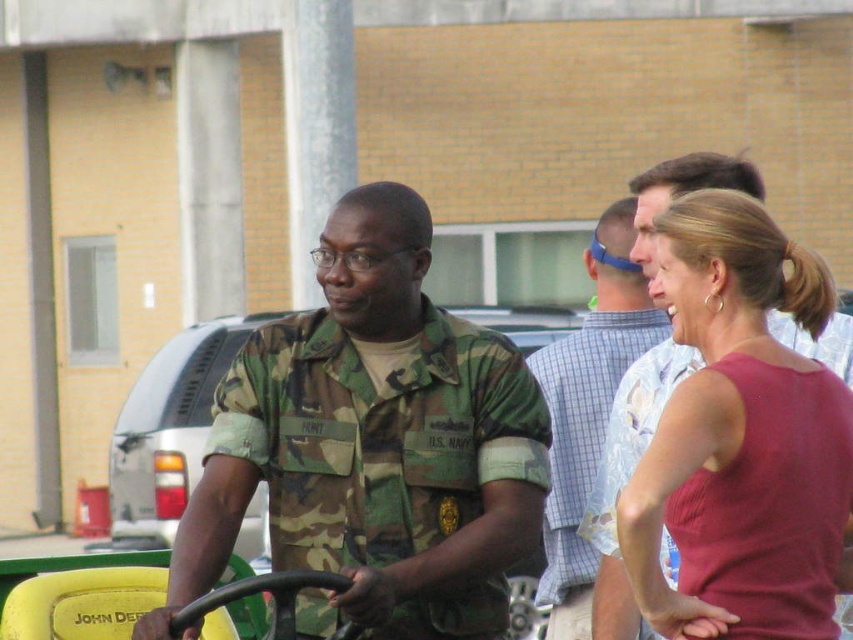
You are standing at the point with coordinates point (x=633, y=228) and want to walk to the point with coordinates point (x=321, y=326). Based on the scene description, which direction should you move to reach your destination?

You should move forward because point (x=321, y=326) is in front of point (x=633, y=228) according to the scene description.

You are a photographer trying to capture a candid shot of both the camo uniform at center and the matte red tank top at center right. Based on their positions, which one should you focus on first to ensure both are in the frame?

The camo uniform at center is positioned under matte red tank top at center right, so you should focus on the matte red tank top at center right first to ensure both are visible in the frame.

Looking at this image, you are a photographer trying to capture a group photo of the camo uniform at center and the matte red tank top at center right. If you want to ensure both subjects are in focus, which one should you adjust the camera focus to prioritize based on their positions?

The camo uniform at center is taller than the matte red tank top at center right, so you should prioritize focusing on the camo uniform at center to ensure both are in focus.